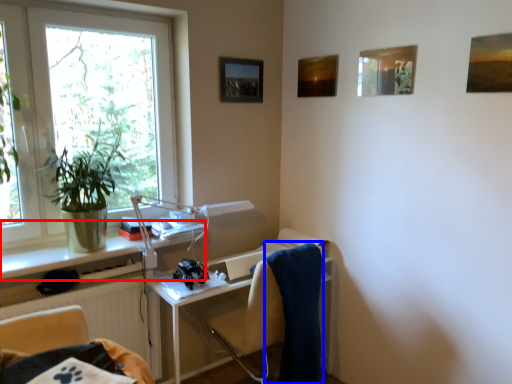
Question: Which object appears closest to the camera in this image, window sill (highlighted by a red box) or bath towel (highlighted by a blue box)?

Choices:
 (A) window sill
 (B) bath towel

Answer: (A)